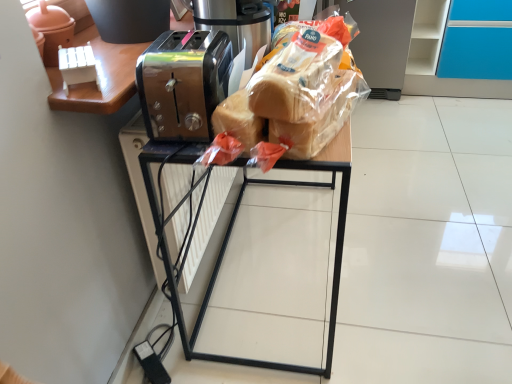
At what (x,y) coordinates should I click in order to perform the action: click on vacant area to the right of metallic toaster at center. Please return your answer as a coordinate pair (x, y). The width and height of the screenshot is (512, 384). Looking at the image, I should click on (417, 242).